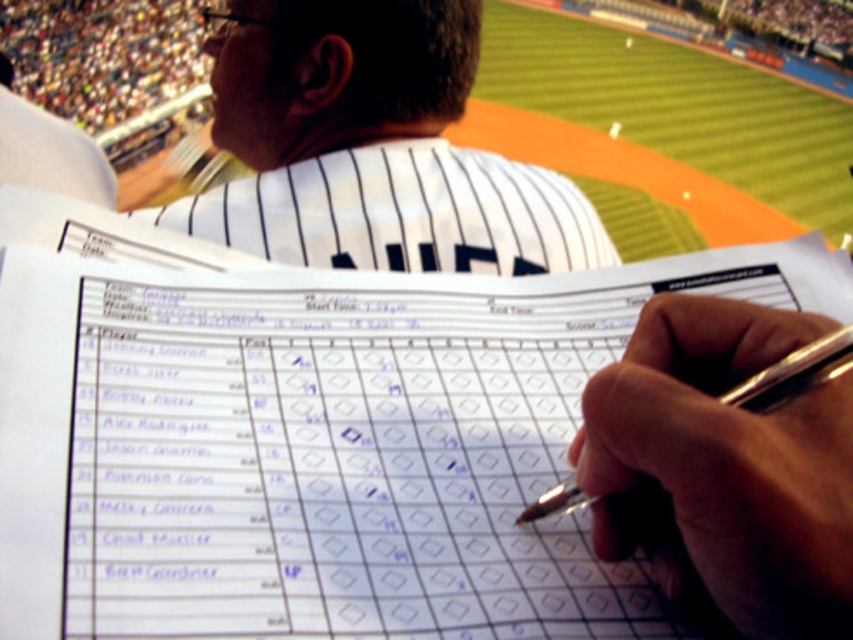
Can you confirm if white pinstriped jersey at upper center is thinner than silver metallic pen at center?

No.

Is white pinstriped jersey at upper center above silver metallic pen at center?

Yes.

Is point (184, 198) closer to viewer compared to point (796, 390)?

That is False.

Where is `white pinstriped jersey at upper center`? The height and width of the screenshot is (640, 853). white pinstriped jersey at upper center is located at coordinates (372, 147).